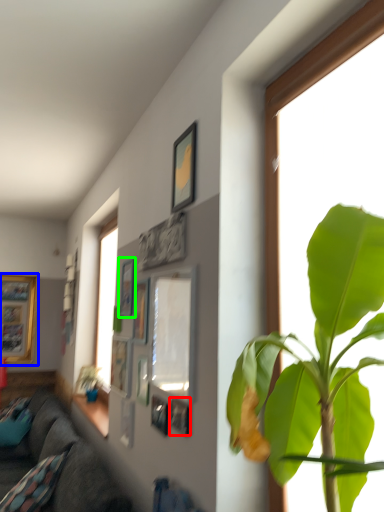
Question: Which object is positioned farthest from picture frame (highlighted by a red box)? Select from picture frame (highlighted by a blue box) and picture frame (highlighted by a green box).

Choices:
 (A) picture frame
 (B) picture frame

Answer: (A)